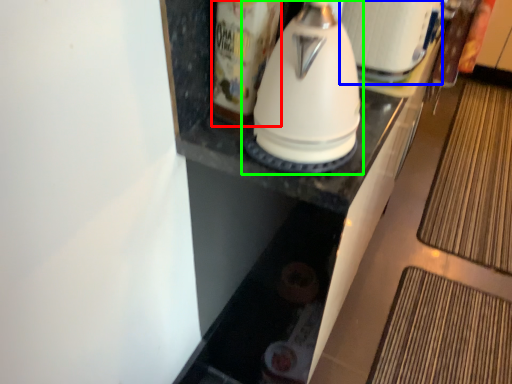
Question: Based on their relative distances, which object is nearer to beverage (highlighted by a red box)? Choose from appliance (highlighted by a blue box) and kitchen appliance (highlighted by a green box).

Choices:
 (A) appliance
 (B) kitchen appliance

Answer: (B)